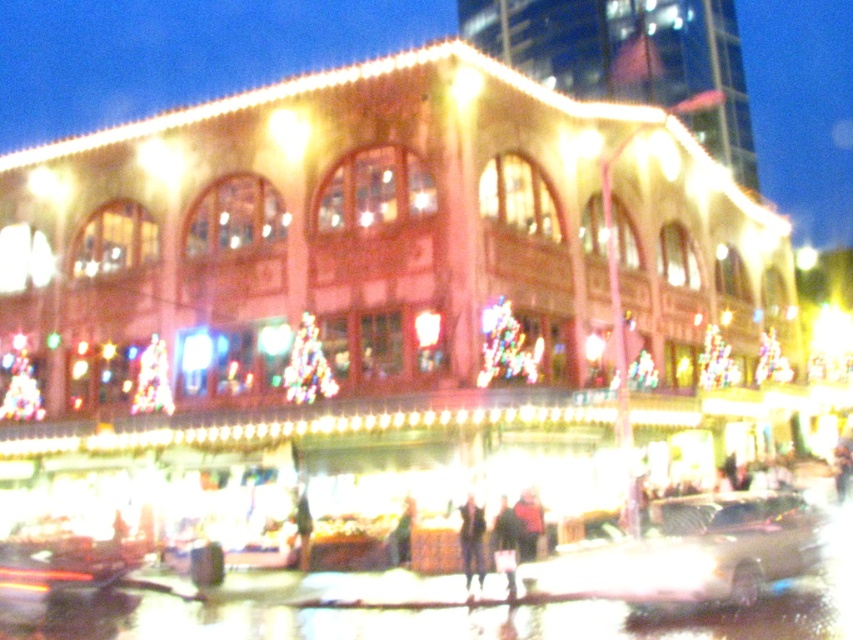
You are a pedestrian standing at the entrance of the building. You want to walk to the metallic gold car at lower center. There is a dark brown leather jacket at center in your path. Can you safely walk around the jacket without getting too close? Please explain.

The metallic gold car at lower center and dark brown leather jacket at center are 7.96 meters apart. Since the distance between them is over 7 meters, there is enough space to safely walk around the dark brown leather jacket at center without getting too close.

In the scene shown: You are a delivery person trying to park your metallic gold car at lower center near the stalls. There is a dark brown leather jacket at center hanging from a pole. Can your car fit without touching the jacket?

The metallic gold car at lower center might be wider than dark brown leather jacket at center, so there is a possibility that the car could touch the jacket if parked too close.